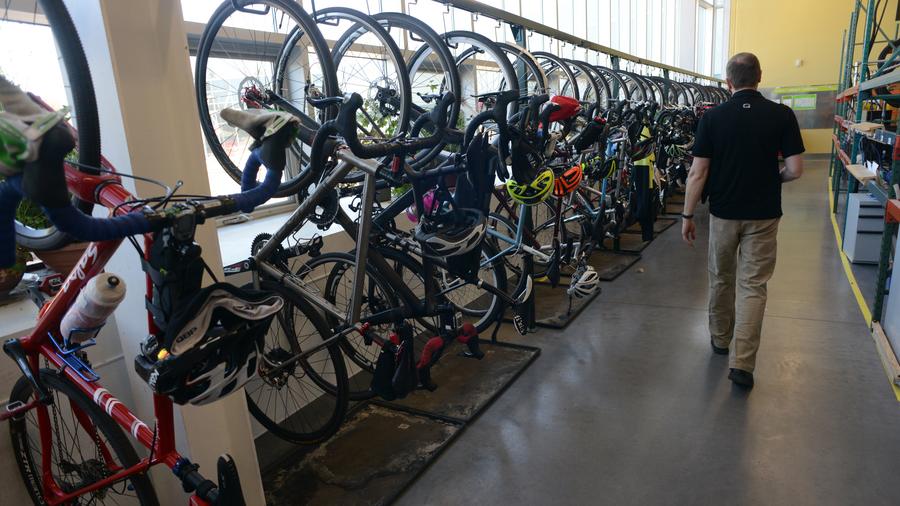
Image resolution: width=900 pixels, height=506 pixels. What are the coordinates of `floor` in the screenshot? It's located at (668, 414).